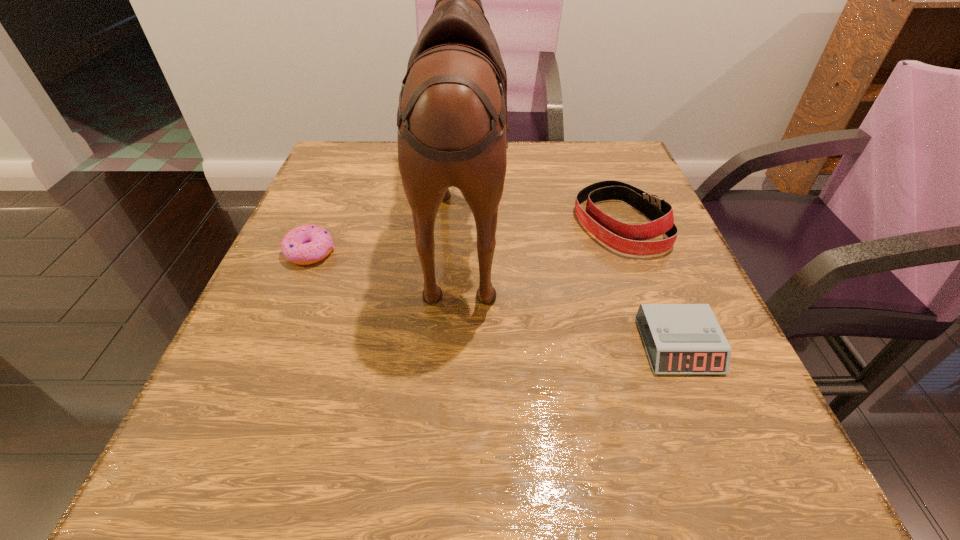
Find the location of `saddle`. saddle is located at coordinates (452, 124).

Where is `the tallest object`? The width and height of the screenshot is (960, 540). the tallest object is located at coordinates (452, 124).

Identify the location of dog collar. The height and width of the screenshot is (540, 960). (626, 238).

This screenshot has width=960, height=540. Identify the location of the leftmost object. (306, 244).

This screenshot has width=960, height=540. What are the coordinates of `alarm clock` in the screenshot? It's located at (683, 338).

Where is `vacant space located 0.140m on the back of the second object from left to right`? Image resolution: width=960 pixels, height=540 pixels. vacant space located 0.140m on the back of the second object from left to right is located at coordinates (569, 218).

At what (x,y) coordinates should I click in order to perform the action: click on free location located on the left of the third shortest object. Please return your answer as a coordinate pair (x, y). The width and height of the screenshot is (960, 540). Looking at the image, I should click on (490, 224).

The height and width of the screenshot is (540, 960). Identify the location of free location located 0.400m on the front of the leftmost object. (206, 496).

This screenshot has height=540, width=960. Identify the location of free space located 0.390m on the back of the alarm clock. (615, 189).

The height and width of the screenshot is (540, 960). I want to click on object present at the far edge, so click(x=452, y=124).